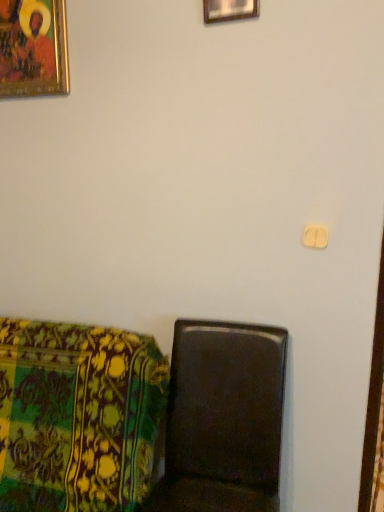
Question: Is point (251, 330) positioned closer to the camera than point (76, 477)?

Choices:
 (A) closer
 (B) farther

Answer: (B)

Question: Visually, is matte brown chair at lower left, marked as the first furniture in a right-to-left arrangement, positioned to the left or to the right of floral fabric cushion at lower left, which is the first furniture in left-to-right order?

Choices:
 (A) right
 (B) left

Answer: (A)

Question: Which is farther from the floral fabric cushion at lower left, which is the first furniture in left-to-right order?

Choices:
 (A) wooden picture frame at upper center, the 2th picture frame viewed from the back
 (B) matte brown chair at lower left, marked as the first furniture in a right-to-left arrangement
 (C) white plastic light switch at upper right
 (D) gold-framed painting at upper left, the first picture frame when ordered from back to front

Answer: (A)

Question: Based on their relative distances, which object is nearer to the matte brown chair at lower left, the second furniture when ordered from left to right?

Choices:
 (A) white plastic light switch at upper right
 (B) floral fabric cushion at lower left, which is the first furniture in left-to-right order
 (C) gold-framed painting at upper left, which appears as the first picture frame when viewed from the left
 (D) wooden picture frame at upper center, the first picture frame viewed from the right

Answer: (B)